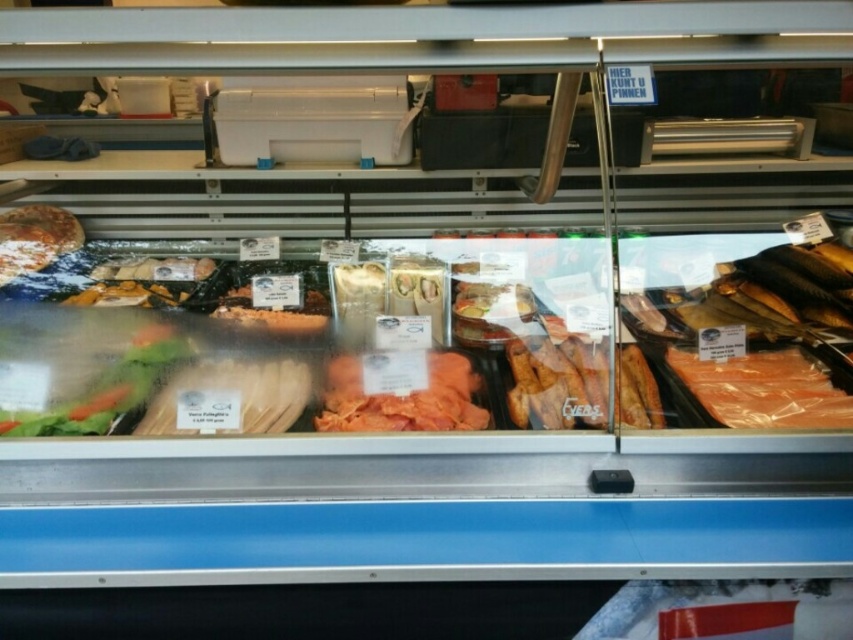
Question: Does pink translucent salmon at right have a greater width compared to pinkish matte salmon at center?

Choices:
 (A) no
 (B) yes

Answer: (A)

Question: Does pinkish matte salmon at center come behind shiny brown bread at left?

Choices:
 (A) yes
 (B) no

Answer: (B)

Question: Can you confirm if pinkish matte salmon at center is positioned to the left of shiny brown bread at left?

Choices:
 (A) no
 (B) yes

Answer: (A)

Question: Which point is closer to the camera?

Choices:
 (A) (787, 362)
 (B) (462, 419)
 (C) (9, 250)

Answer: (B)

Question: Which object is the closest to the pink translucent salmon at right?

Choices:
 (A) pinkish matte salmon at center
 (B) shiny brown bread at left

Answer: (A)

Question: Which object appears closest to the camera in this image?

Choices:
 (A) pink translucent salmon at right
 (B) pinkish matte salmon at center
 (C) shiny brown bread at left

Answer: (A)